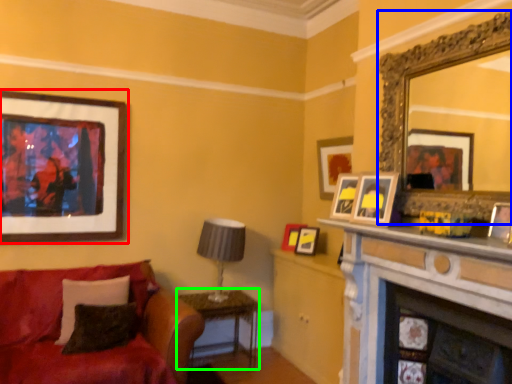
Question: Which object is the farthest from picture frame (highlighted by a red box)? Choose among these: mirror (highlighted by a blue box) or table (highlighted by a green box).

Choices:
 (A) mirror
 (B) table

Answer: (A)